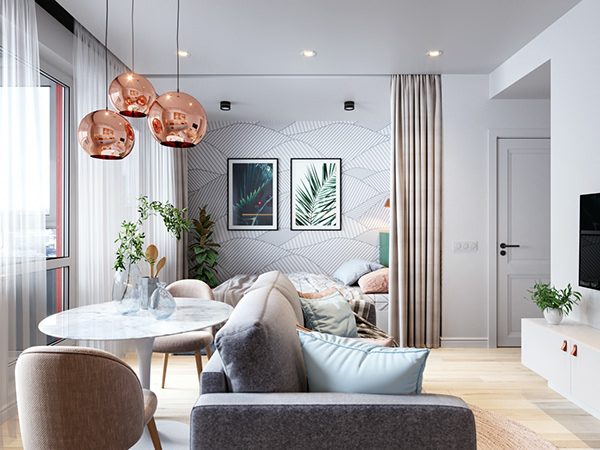
Where is `gray cloth living room love seat`? Image resolution: width=600 pixels, height=450 pixels. gray cloth living room love seat is located at coordinates (330, 433).